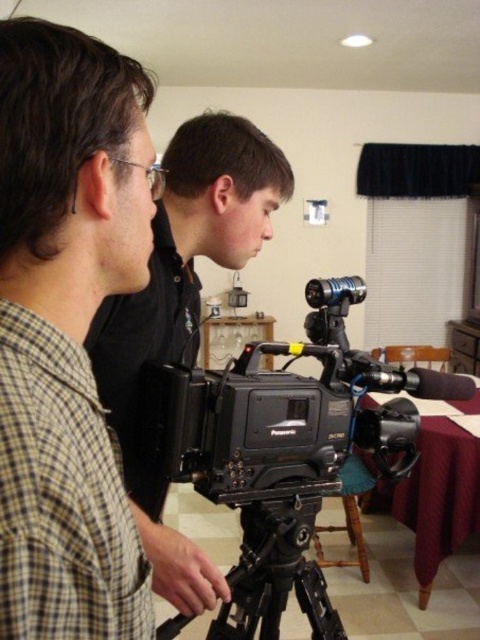
Question: Does black plastic video camera at center have a lesser width compared to black matte tripod at center?

Choices:
 (A) yes
 (B) no

Answer: (B)

Question: From the image, what is the correct spatial relationship of black matte camera at center in relation to black matte tripod at center?

Choices:
 (A) above
 (B) below

Answer: (A)

Question: Which object is positioned closest to the black matte tripod at center?

Choices:
 (A) black matte camera at center
 (B) black plastic video camera at center

Answer: (B)

Question: Which of the following is the farthest from the observer?

Choices:
 (A) (276, 397)
 (B) (123, 435)
 (C) (268, 604)

Answer: (C)

Question: Is black plastic video camera at center bigger than black matte tripod at center?

Choices:
 (A) yes
 (B) no

Answer: (A)

Question: Which object is farther from the camera taking this photo?

Choices:
 (A) black matte camera at center
 (B) black plastic video camera at center
 (C) black matte tripod at center

Answer: (B)